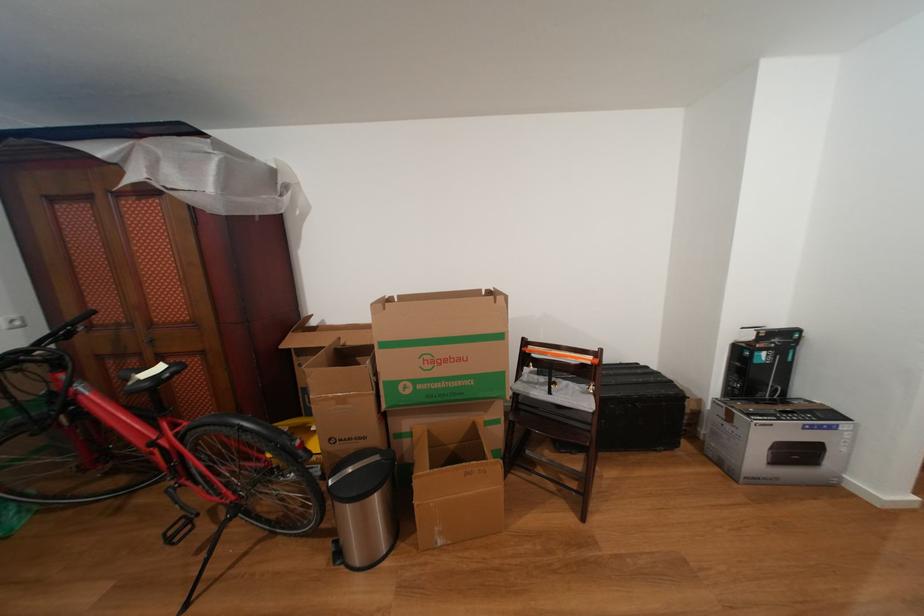
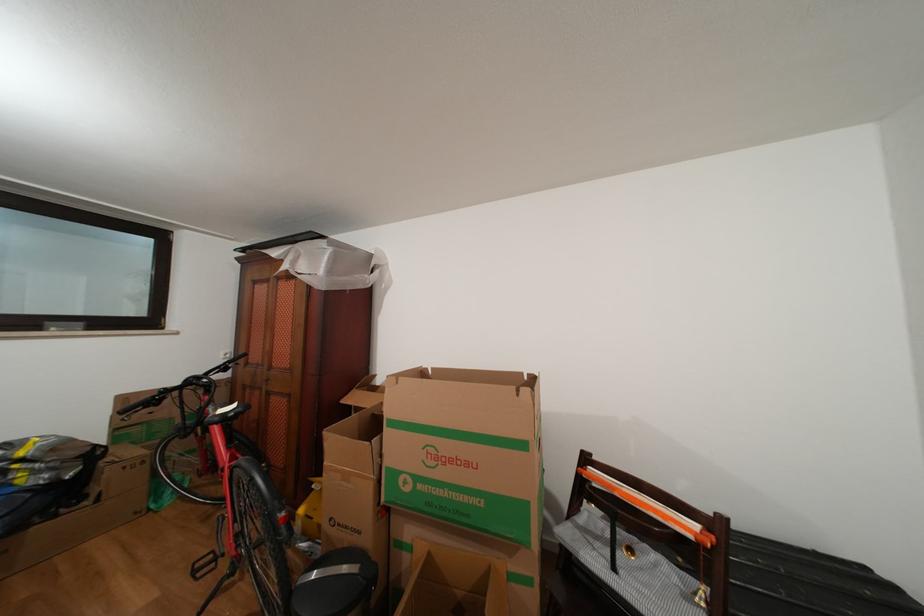
Locate, in the second image, the point that corresponds to (x=289, y=352) in the first image.

(350, 407)